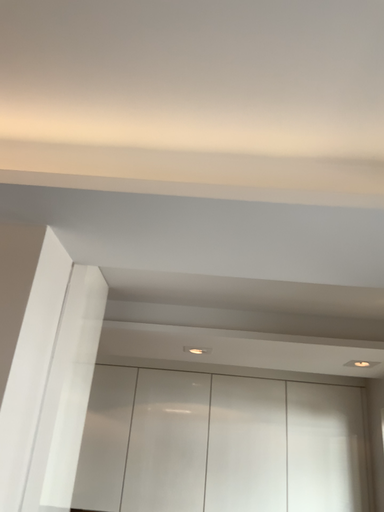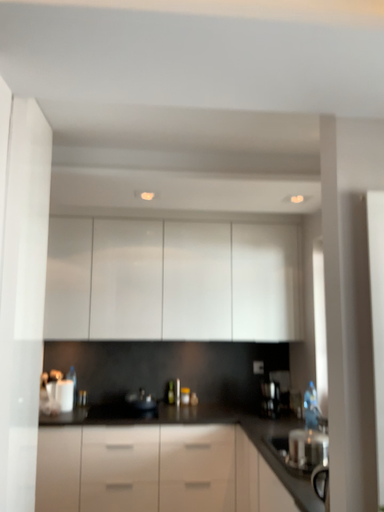
Question: Which way did the camera rotate in the video?

Choices:
 (A) rotated upward
 (B) rotated downward

Answer: (B)